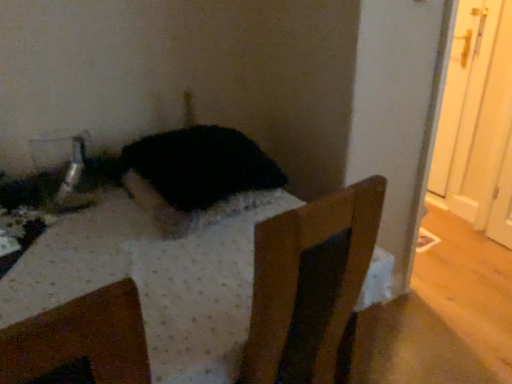
Locate an element on the screen. The height and width of the screenshot is (384, 512). free location in front of black fur cat at center is located at coordinates (169, 272).